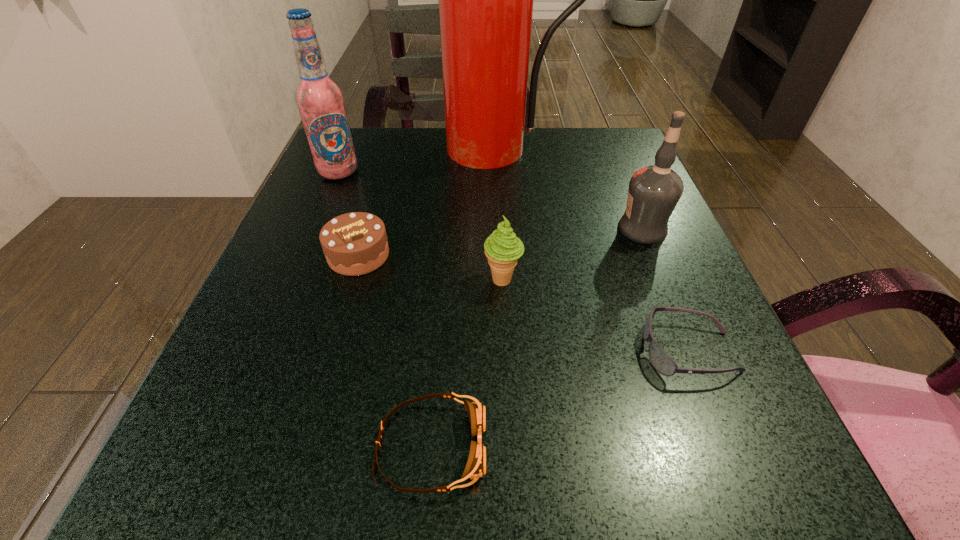
Locate an element on the screen. The width and height of the screenshot is (960, 540). the tallest object is located at coordinates (485, 0).

What are the coordinates of `the sixth shortest object` in the screenshot? It's located at (320, 101).

At what (x,y) coordinates should I click in order to perform the action: click on vodka. Please return your answer as a coordinate pair (x, y). This screenshot has width=960, height=540. Looking at the image, I should click on (x=654, y=191).

Identify the location of icecream. (502, 248).

The width and height of the screenshot is (960, 540). I want to click on the third shortest object, so pos(356,243).

Where is `the sixth farthest object`? Image resolution: width=960 pixels, height=540 pixels. the sixth farthest object is located at coordinates (661, 361).

You are a GUI agent. You are given a task and a screenshot of the screen. Output one action in this format:
    pyautogui.click(x=<x>, y=<y>)
    Task: Click on the goggles
    The image size is (960, 540).
    Given the screenshot: What is the action you would take?
    pyautogui.click(x=475, y=467)

Find the location of a particular element. The height and width of the screenshot is (540, 960). free space located 0.140m with the handle and nozzle on the fire extinguisher is located at coordinates (507, 207).

Where is `free space located on the front of the sixth shortest object`? The width and height of the screenshot is (960, 540). free space located on the front of the sixth shortest object is located at coordinates (272, 330).

The width and height of the screenshot is (960, 540). Identify the location of vacant space located on the front label of the third tallest object. (424, 229).